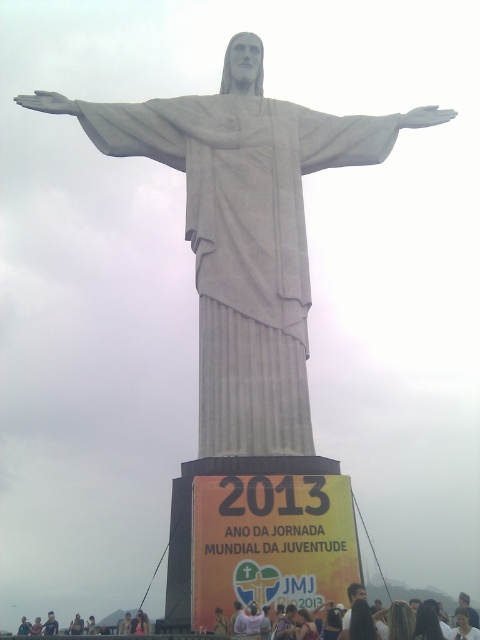
Question: Among these objects, which one is nearest to the camera?

Choices:
 (A) light brown hair at lower center
 (B) white fabric crowd at lower center

Answer: (B)

Question: Which point is closer to the camera?

Choices:
 (A) light brown hair at lower left
 (B) light brown hair at lower center
 (C) white fabric crowd at lower center

Answer: (C)

Question: Does white fabric crowd at lower center appear on the left side of light brown hair at lower left?

Choices:
 (A) yes
 (B) no

Answer: (B)

Question: Which object appears farthest from the camera in this image?

Choices:
 (A) light brown hair at lower left
 (B) light brown hair at lower center
 (C) white fabric crowd at lower center

Answer: (A)

Question: Is white marble statue at center closer to camera compared to light brown hair at lower left?

Choices:
 (A) no
 (B) yes

Answer: (B)

Question: Does white marble statue at center appear on the right side of light brown hair at lower center?

Choices:
 (A) no
 (B) yes

Answer: (B)